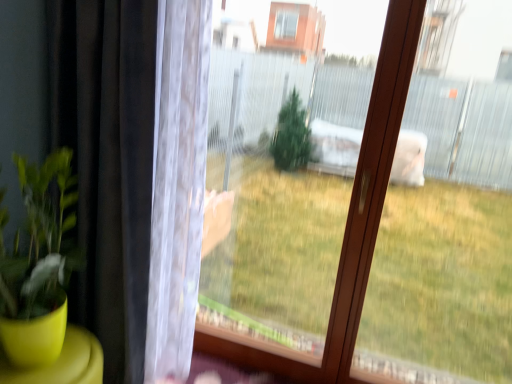
The image size is (512, 384). Find the location of `transparent plastic screen at center`. transparent plastic screen at center is located at coordinates [351, 214].

The image size is (512, 384). What do you see at coordinates (351, 214) in the screenshot?
I see `transparent plastic screen at center` at bounding box center [351, 214].

The image size is (512, 384). What do you see at coordinates (134, 170) in the screenshot?
I see `black matte curtain at left` at bounding box center [134, 170].

Image resolution: width=512 pixels, height=384 pixels. I want to click on black matte curtain at left, so click(x=134, y=170).

Where is `transparent plastic screen at center`? transparent plastic screen at center is located at coordinates (351, 214).

Between black matte curtain at left and transparent plastic screen at center, which one appears on the right side from the viewer's perspective?

transparent plastic screen at center is more to the right.

Is black matte curtain at left further to the viewer compared to transparent plastic screen at center?

No, black matte curtain at left is closer to the viewer.

Based on the photo, which point is more distant from viewer, (196, 49) or (387, 30)?

The point (196, 49) is farther from the camera.

From the image's perspective, relative to transparent plastic screen at center, is black matte curtain at left above or below?

From the image's perspective, black matte curtain at left appears above transparent plastic screen at center.

From a real-world perspective, is black matte curtain at left below transparent plastic screen at center?

Indeed, from a real-world perspective, black matte curtain at left is positioned beneath transparent plastic screen at center.

Does black matte curtain at left have a greater width compared to transparent plastic screen at center?

Indeed, black matte curtain at left has a greater width compared to transparent plastic screen at center.

In terms of height, does black matte curtain at left look taller or shorter compared to transparent plastic screen at center?

black matte curtain at left is shorter than transparent plastic screen at center.

Between black matte curtain at left and transparent plastic screen at center, which one has smaller size?

transparent plastic screen at center is smaller.

Is black matte curtain at left not inside transparent plastic screen at center?

Yes, black matte curtain at left is not within transparent plastic screen at center.

Is black matte curtain at left touching transparent plastic screen at center?

They are not placed beside each other.

Is black matte curtain at left positioned with its back to transparent plastic screen at center?

That's not correct — black matte curtain at left is not looking away from transparent plastic screen at center.

How different are the orientations of black matte curtain at left and transparent plastic screen at center in degrees?

There is a 2.23-degree angle between the facing directions of black matte curtain at left and transparent plastic screen at center.

How far apart are black matte curtain at left and transparent plastic screen at center?

The distance of black matte curtain at left from transparent plastic screen at center is 28.66 inches.

This screenshot has height=384, width=512. I want to click on curtain that appears above the transparent plastic screen at center (from the image's perspective), so click(x=134, y=170).

Based on their positions, is transparent plastic screen at center located to the left or right of black matte curtain at left?

Based on their positions, transparent plastic screen at center is located to the right of black matte curtain at left.

In the image, is transparent plastic screen at center positioned in front of or behind black matte curtain at left?

transparent plastic screen at center is behind black matte curtain at left.

Considering the points (249, 366) and (156, 160), which point is in front, point (249, 366) or point (156, 160)?

The point (156, 160) is in front.

From the image's perspective, which is below, transparent plastic screen at center or black matte curtain at left?

transparent plastic screen at center, from the image's perspective.

From a real-world perspective, is transparent plastic screen at center positioned above or below black matte curtain at left?

Clearly, from a real-world perspective, transparent plastic screen at center is above black matte curtain at left.

Between transparent plastic screen at center and black matte curtain at left, which one has smaller width?

Thinner between the two is transparent plastic screen at center.

Who is shorter, transparent plastic screen at center or black matte curtain at left?

With less height is black matte curtain at left.

Considering the relative sizes of transparent plastic screen at center and black matte curtain at left in the image provided, is transparent plastic screen at center smaller than black matte curtain at left?

Yes.

Is transparent plastic screen at center positioned beyond the bounds of black matte curtain at left?

Yes, transparent plastic screen at center is outside of black matte curtain at left.

Is transparent plastic screen at center placed right next to black matte curtain at left?

transparent plastic screen at center and black matte curtain at left are not in contact.

Is transparent plastic screen at center positioned with its back to black matte curtain at left?

transparent plastic screen at center does not have its back to black matte curtain at left.

Identify the location of bay window on the right of black matte curtain at left. Image resolution: width=512 pixels, height=384 pixels. (351, 214).

Identify the location of curtain in front of the transparent plastic screen at center. The height and width of the screenshot is (384, 512). (x=134, y=170).

At what (x,y) coordinates should I click in order to perform the action: click on curtain on the left of transparent plastic screen at center. Please return your answer as a coordinate pair (x, y). Looking at the image, I should click on (134, 170).